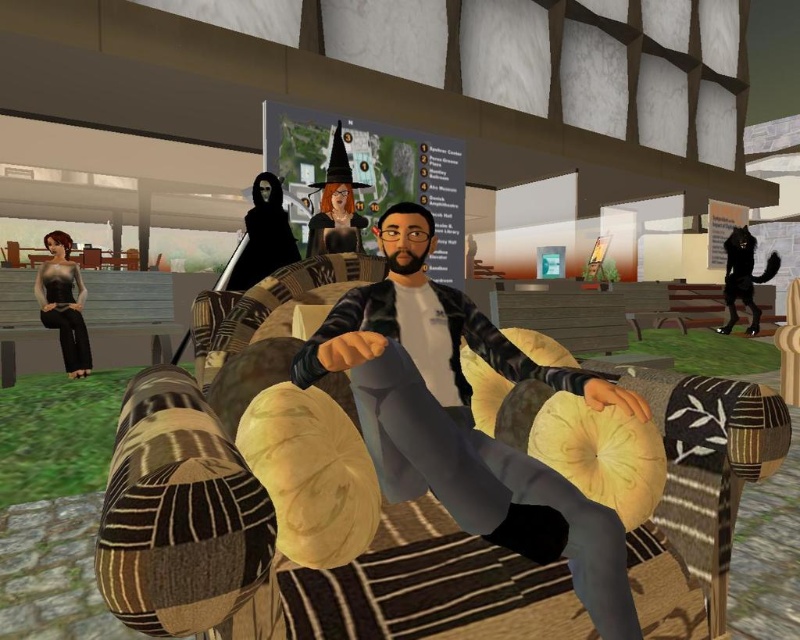
You are standing in the virtual environment and notice two objects, the matte gray sweater at center and the black matte figure at upper center. Which object is positioned to the right of the other?

The matte gray sweater at center is to the right of the black matte figure at upper center.

You are a fashion designer observing a virtual fitting room scene. You see the matte gray sweater at center and the matte black dress at left. Which clothing item is shorter in height?

The matte gray sweater at center is not as tall as the matte black dress at left, so the matte gray sweater at center is shorter in height.